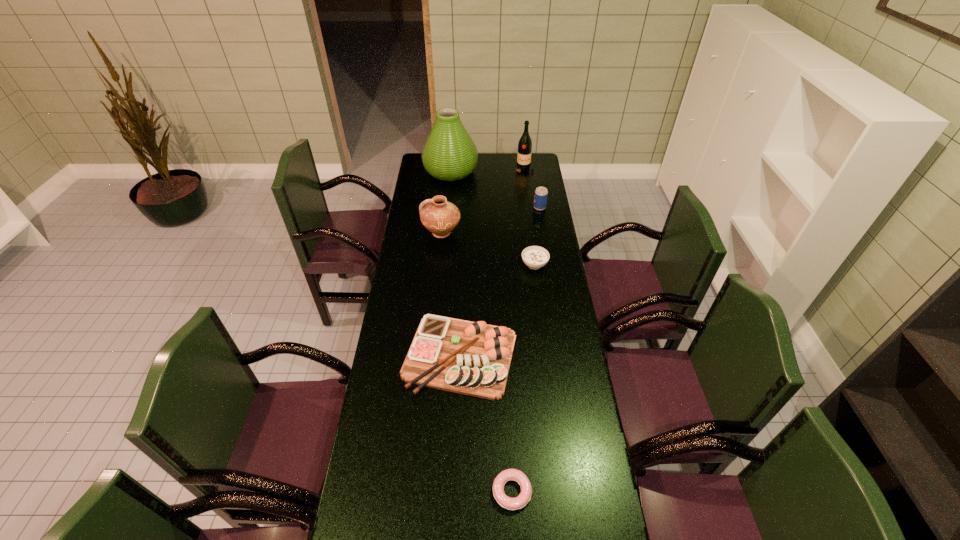
Point out which object is positioned as the fourth nearest to the pottery. Please provide its 2D coordinates. Your answer should be formatted as a tuple, i.e. [(x, y)], where the tuple contains the x and y coordinates of a point satisfying the conditions above.

[(472, 358)]

Find the location of a particular element. Image resolution: width=960 pixels, height=540 pixels. vacant space that satisfies the following two spatial constraints: 1. on the surface of the third farthest object; 2. on the left side of the wine bottle is located at coordinates (530, 208).